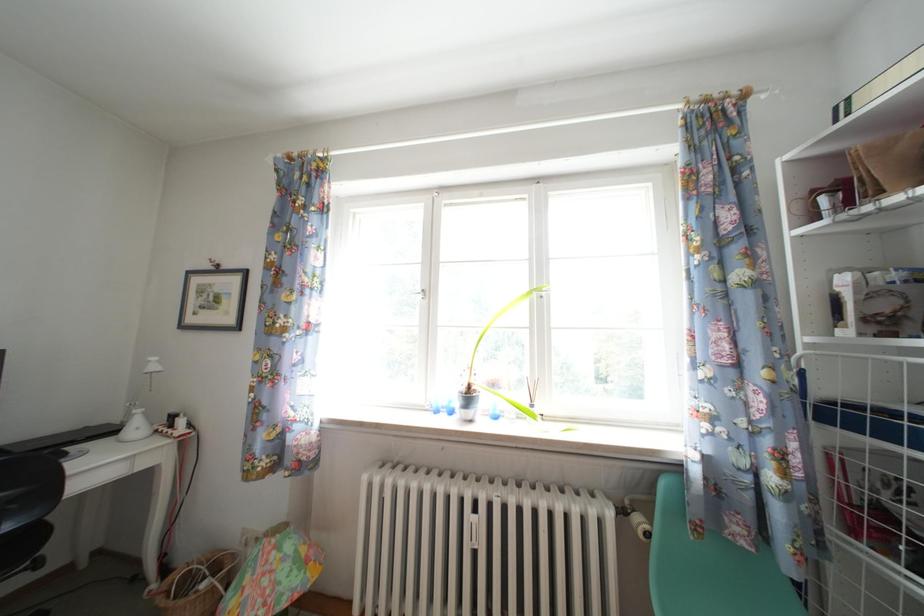
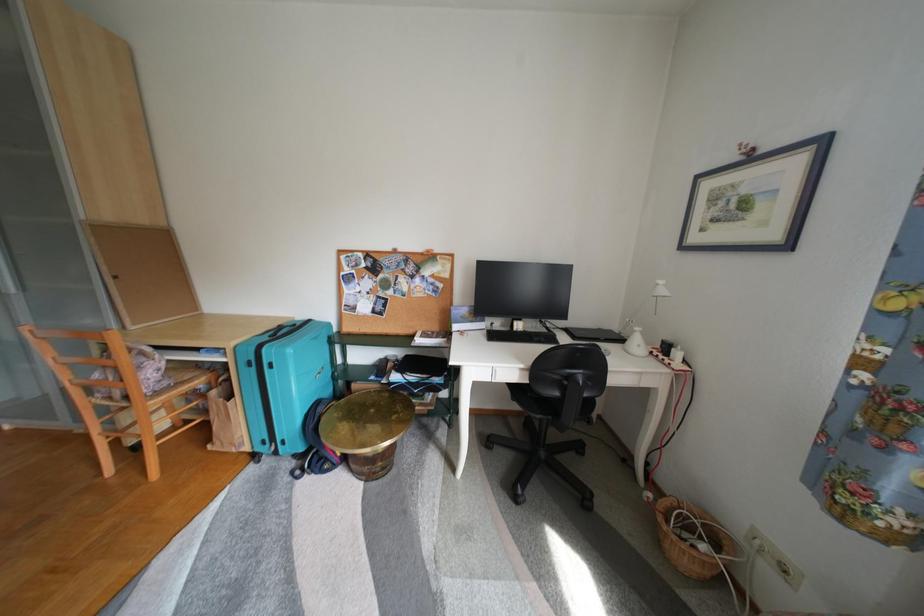
Question: Based on the continuous images, in which direction is the camera rotating? Reply with the corresponding letter.

Choices:
 (A) Left
 (B) Right
 (C) Up
 (D) Down

Answer: (A)